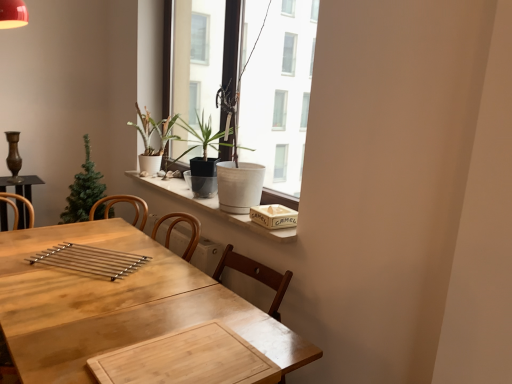
Image resolution: width=512 pixels, height=384 pixels. What are the coordinates of `blank space situated above wooden table at center (from a real-world perspective)` in the screenshot? It's located at (131, 327).